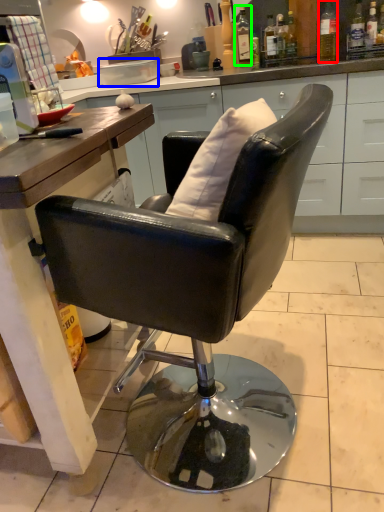
Question: Which object is the closest to the bottle (highlighted by a red box)? Choose among these: plate (highlighted by a blue box) or bottle (highlighted by a green box).

Choices:
 (A) plate
 (B) bottle

Answer: (B)